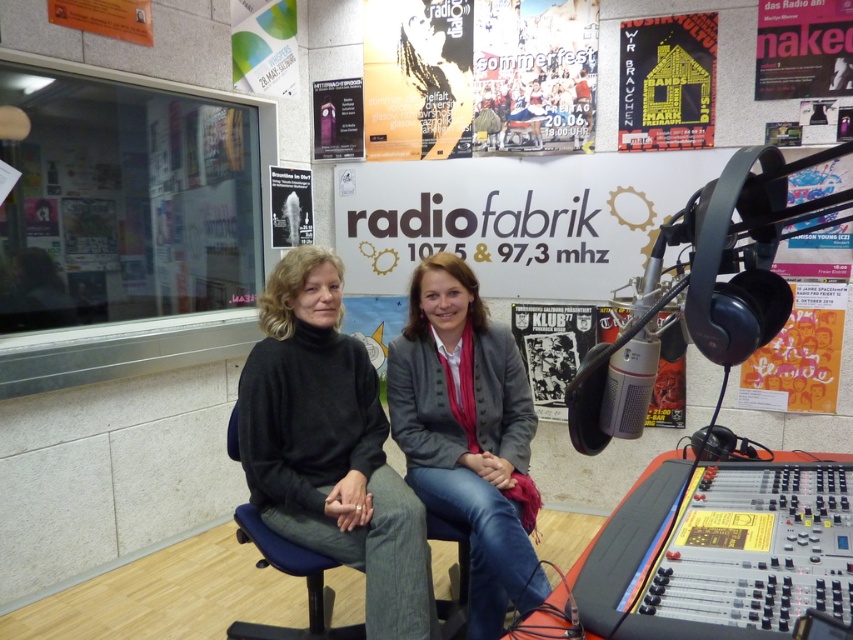
Is point (517, 456) less distant than point (357, 93)?

Yes.

Which is more to the left, gray woolen blazer at center or matte purple fabric poster at upper center?

matte purple fabric poster at upper center

Does point (506, 428) come farther from viewer compared to point (323, 140)?

No, it is in front of (323, 140).

Image resolution: width=853 pixels, height=640 pixels. Find the location of `gray woolen blazer at center`. gray woolen blazer at center is located at coordinates (468, 435).

Does matte black poster at upper right appear over black paper poster at center?

Indeed, matte black poster at upper right is positioned over black paper poster at center.

Who is taller, matte black poster at upper right or black paper poster at center?

black paper poster at center

Is point (822, 24) farther from viewer compared to point (563, 328)?

No, it is not.

Where is `matte black poster at upper right`? The height and width of the screenshot is (640, 853). matte black poster at upper right is located at coordinates (804, 49).

Does gray woolen blazer at center have a lesser height compared to matte paper poster at upper right?

No, gray woolen blazer at center is not shorter than matte paper poster at upper right.

Is point (392, 436) in front of point (822, 307)?

Yes.

The image size is (853, 640). Describe the element at coordinates (468, 435) in the screenshot. I see `gray woolen blazer at center` at that location.

Where is `gray woolen blazer at center`? The width and height of the screenshot is (853, 640). gray woolen blazer at center is located at coordinates (468, 435).